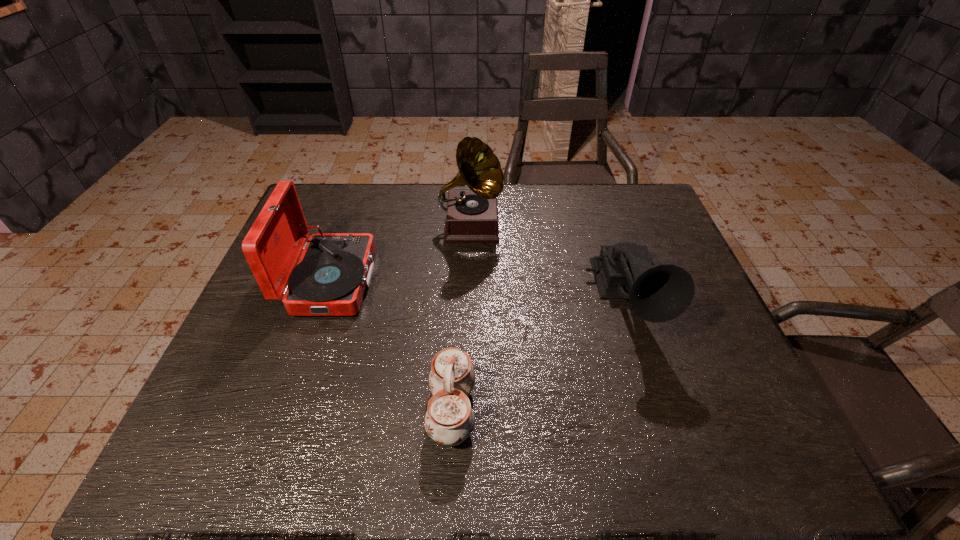
Where is `vacant space at the far right corner of the desktop`? The height and width of the screenshot is (540, 960). vacant space at the far right corner of the desktop is located at coordinates (636, 184).

What are the coordinates of `vacant space at the near right corner` in the screenshot? It's located at (739, 457).

Locate an element on the screen. The height and width of the screenshot is (540, 960). free space between the leftmost phonograph_record and the shortest object is located at coordinates (392, 346).

Identify the location of vacant space that is in between the leftmost object and the rightmost phonograph_record. Image resolution: width=960 pixels, height=540 pixels. point(478,292).

Find the location of `blank region between the rightmost phonograph_record and the tallest phonograph_record`. blank region between the rightmost phonograph_record and the tallest phonograph_record is located at coordinates (548, 264).

You are a GUI agent. You are given a task and a screenshot of the screen. Output one action in this format:
    pyautogui.click(x=<x>, y=<y>)
    Task: Click on the vacant area that lies between the rightmost phonograph_record and the leftmost phonograph_record
    The height and width of the screenshot is (540, 960).
    Given the screenshot: What is the action you would take?
    pyautogui.click(x=478, y=292)

Locate an element on the screen. The height and width of the screenshot is (540, 960). free space between the nearest object and the leftmost object is located at coordinates (392, 346).

Where is `vacant point located between the nearest object and the leftmost phonograph_record`? This screenshot has width=960, height=540. vacant point located between the nearest object and the leftmost phonograph_record is located at coordinates (392, 346).

This screenshot has width=960, height=540. Find the location of `blank region between the tallest phonograph_record and the leftmost object`. blank region between the tallest phonograph_record and the leftmost object is located at coordinates point(401,253).

Where is `blank region between the nearest object and the tallest phonograph_record`? The image size is (960, 540). blank region between the nearest object and the tallest phonograph_record is located at coordinates (462, 318).